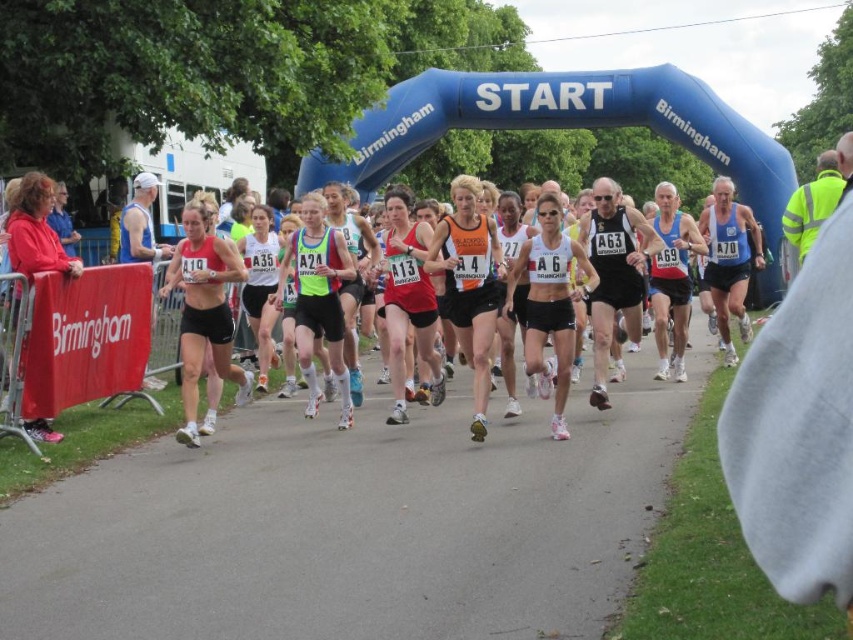
Question: Is matte red tank top at center bigger than red fleece jacket at left?

Choices:
 (A) no
 (B) yes

Answer: (B)

Question: Can you confirm if asphalt road at center is smaller than red fleece jacket at left?

Choices:
 (A) yes
 (B) no

Answer: (B)

Question: Which object is the closest to the white matte tank top at center?

Choices:
 (A) matte red tank top at center
 (B) asphalt road at center
 (C) red fleece jacket at left

Answer: (B)

Question: Which point appears farthest from the camera in this image?

Choices:
 (A) click(x=28, y=202)
 (B) click(x=561, y=285)
 (C) click(x=222, y=294)

Answer: (B)

Question: Does matte red tank top at center have a smaller size compared to white matte tank top at center?

Choices:
 (A) yes
 (B) no

Answer: (B)

Question: Considering the real-world distances, which object is closest to the red fleece jacket at left?

Choices:
 (A) matte red tank top at center
 (B) asphalt road at center
 (C) white matte tank top at center

Answer: (A)